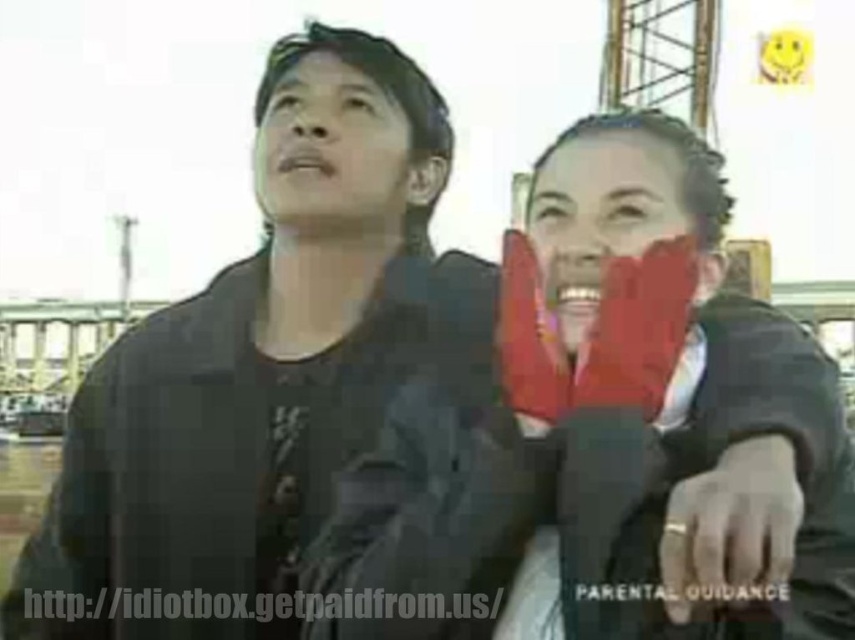
You are a security analyst reviewing a video feed. You notice two objects in the frame, the matte black face at upper center and the matte red gloves at center. Which object is wider?

The matte red gloves at center is wider than the matte black face at upper center.